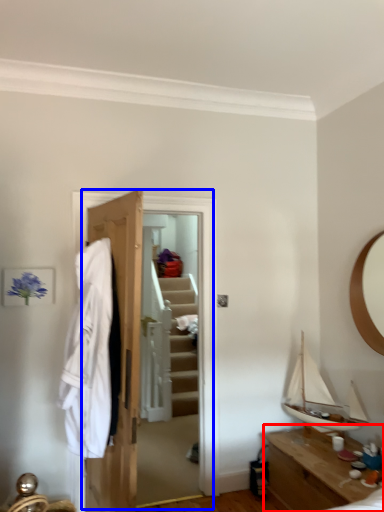
Question: Which of the following is the farthest to the observer, table (highlighted by a red box) or closet (highlighted by a blue box)?

Choices:
 (A) table
 (B) closet

Answer: (B)